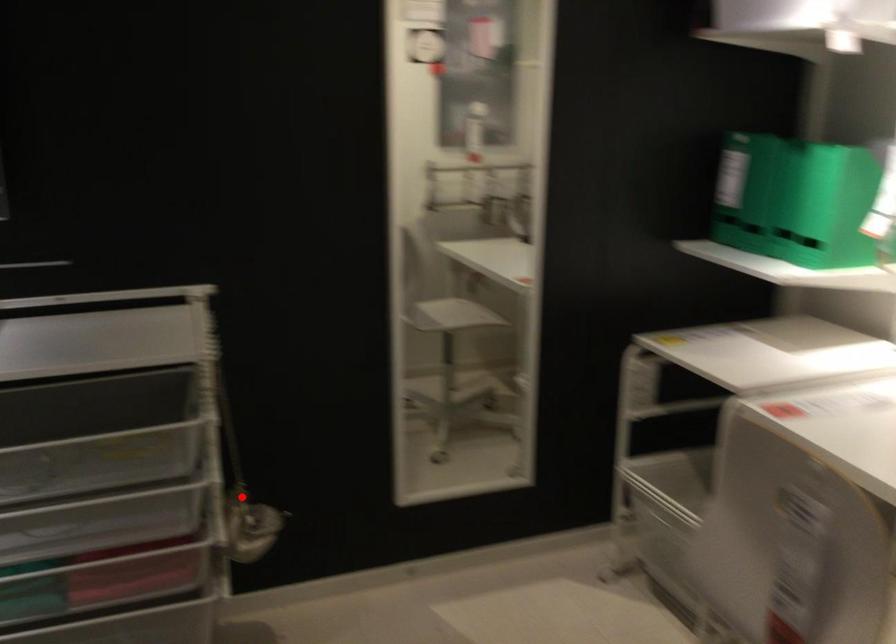
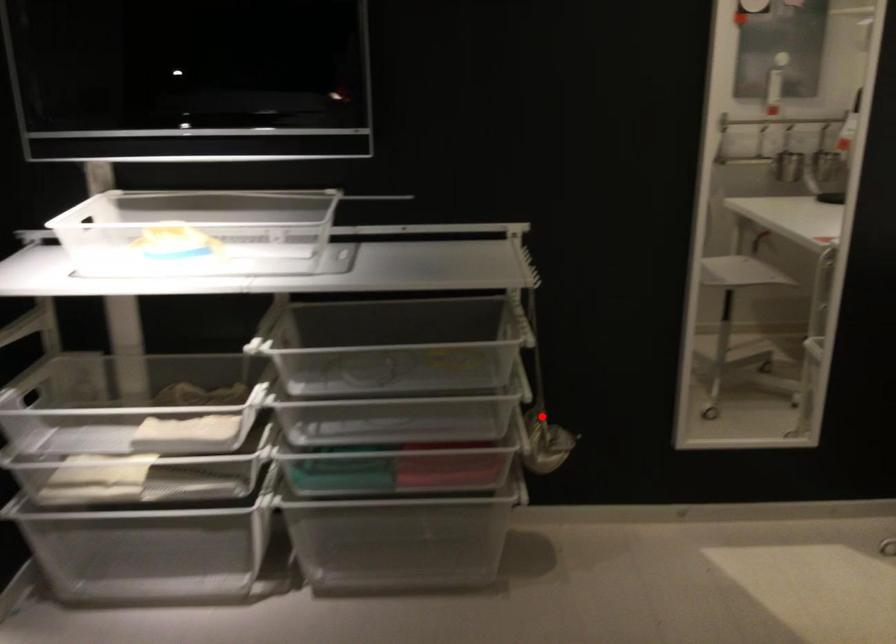
I am providing you with two images of the same scene from different viewpoints. A red point is marked on the first image and another point is marked on the second image. Is the marked point in image1 the same physical position as the marked point in image2?

Yes